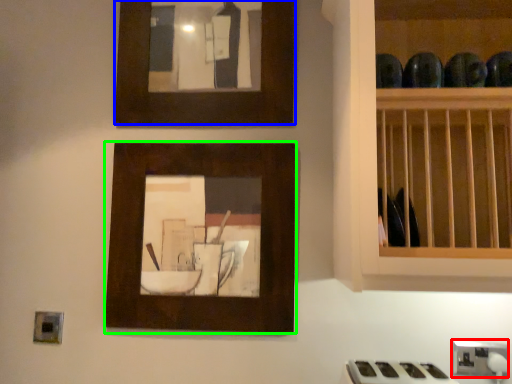
Question: Based on their relative distances, which object is farther from electric outlet (highlighted by a red box)? Choose from picture frame (highlighted by a blue box) and picture frame (highlighted by a green box).

Choices:
 (A) picture frame
 (B) picture frame

Answer: (A)